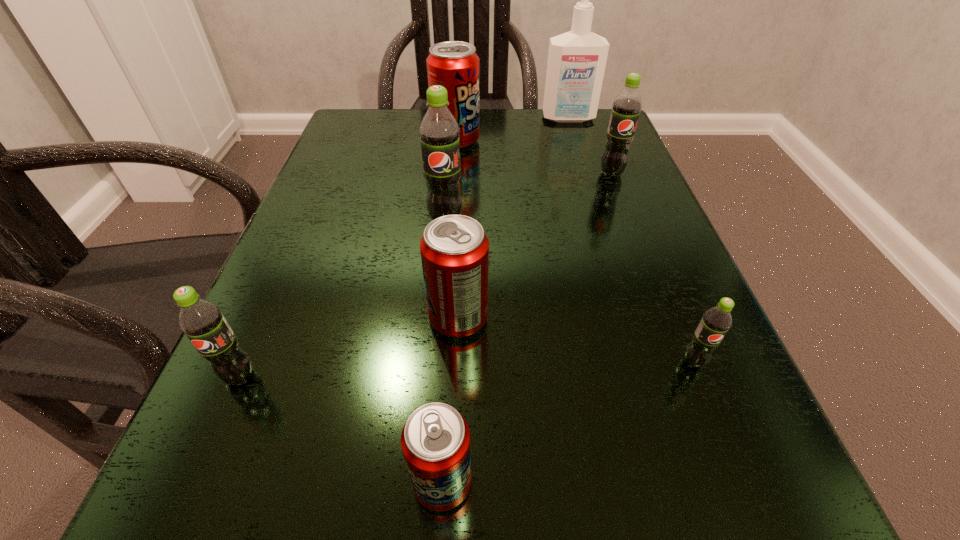
This screenshot has height=540, width=960. Find the location of `vacant region at the left edge of the desktop`. vacant region at the left edge of the desktop is located at coordinates (319, 182).

The height and width of the screenshot is (540, 960). In the image, there is a desktop. Find the location of `free space at the right edge`. free space at the right edge is located at coordinates (577, 199).

At what (x,y) coordinates should I click in order to perform the action: click on vacant space at the far left corner. Please return your answer as a coordinate pair (x, y). The height and width of the screenshot is (540, 960). Looking at the image, I should click on (383, 130).

Where is `vacant region at the near left corner of the desktop`? This screenshot has height=540, width=960. vacant region at the near left corner of the desktop is located at coordinates (180, 494).

I want to click on free spot between the leftmost green soda and the biggest red soda can, so pos(348,259).

Where is `unoccupied area between the second farthest red soda can and the smallest green soda`? Image resolution: width=960 pixels, height=540 pixels. unoccupied area between the second farthest red soda can and the smallest green soda is located at coordinates (576, 340).

Identify the location of vacant area that lies between the second farthest object and the sixth nearest object. (534, 158).

This screenshot has height=540, width=960. What are the coordinates of `unoccupied position between the third nearest green soda and the second biggest green soda` in the screenshot? It's located at (528, 197).

I want to click on vacant point located between the third smallest green soda and the cleansing agent, so click(590, 146).

This screenshot has height=540, width=960. Identify the location of free space between the smallest red soda can and the farthest green soda. (527, 328).